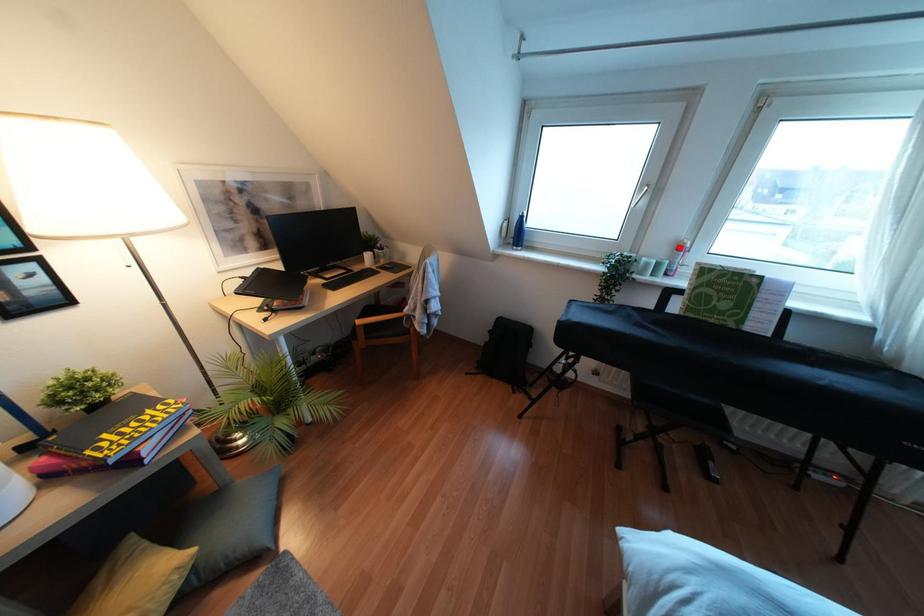
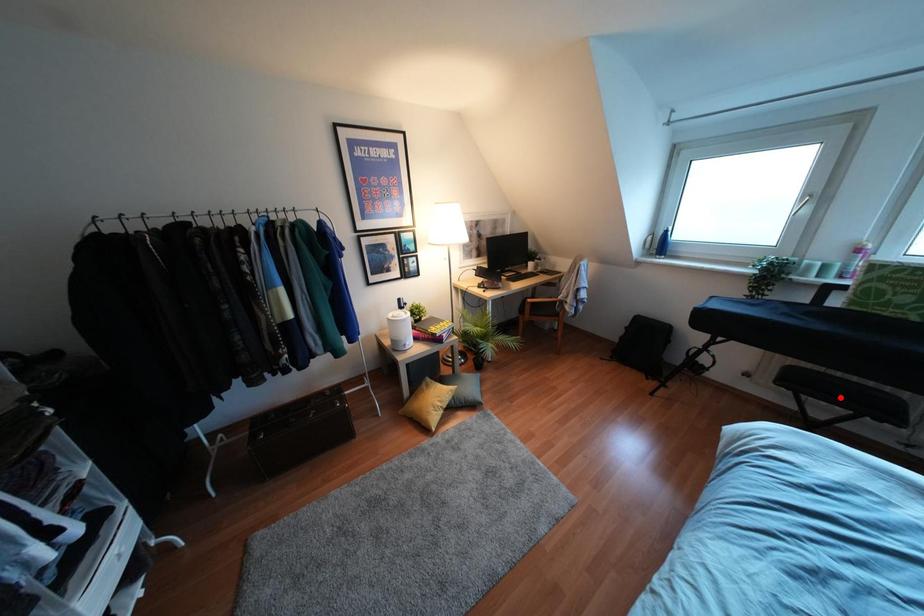
I am providing you with two images of the same scene from different viewpoints. A red point is marked on the first image and another point is marked on the second image. Is the red point in image1 aligned with the point shown in image2?

No